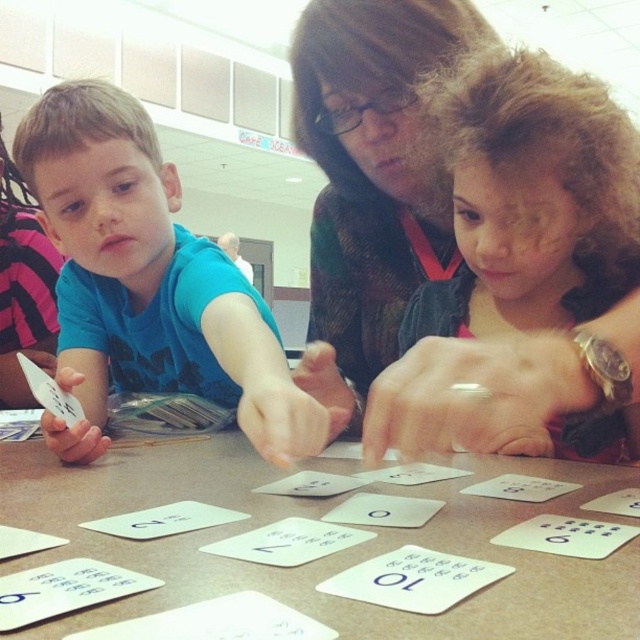
Who is shorter, white paper cards at center or matte blue shirt at left?

Standing shorter between the two is white paper cards at center.

Who is positioned more to the left, white paper cards at center or matte blue shirt at left?

Answer: From the viewer's perspective, matte blue shirt at left appears more on the left side.

Image resolution: width=640 pixels, height=640 pixels. In order to click on white paper cards at center in this screenshot , I will do `click(320, 548)`.

Can you confirm if curly brown hair at upper right is thinner than matte blue shirt at left?

Yes.

Based on the photo, who is more distant from viewer, (516,134) or (129,241)?

Positioned behind is point (129,241).

Who is more forward, (522,248) or (88,220)?

Positioned in front is point (522,248).

At what (x,y) coordinates should I click in order to perform the action: click on curly brown hair at upper right. Please return your answer as a coordinate pair (x, y). Looking at the image, I should click on (524, 272).

Which is in front, point (177, 472) or point (508, 403)?

Point (508, 403)

Is point (172, 564) closer to camera compared to point (621, 449)?

Yes.

The width and height of the screenshot is (640, 640). What are the coordinates of `white paper cards at center` in the screenshot? It's located at pyautogui.click(x=320, y=548).